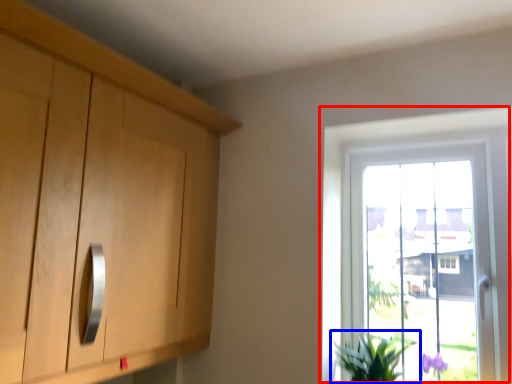
Question: Which point is further to the camera, window (highlighted by a red box) or houseplant (highlighted by a blue box)?

Choices:
 (A) window
 (B) houseplant

Answer: (A)